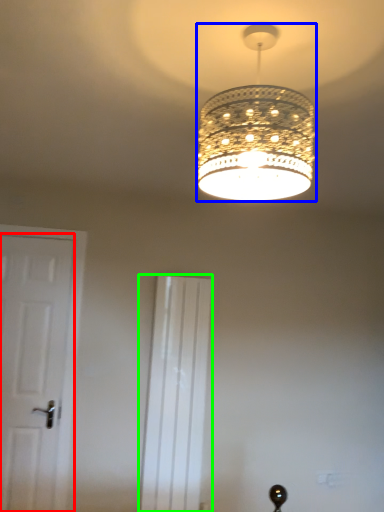
Question: Which object is the farthest from door (highlighted by a red box)? Choose among these: lamp (highlighted by a blue box) or screen door (highlighted by a green box).

Choices:
 (A) lamp
 (B) screen door

Answer: (A)